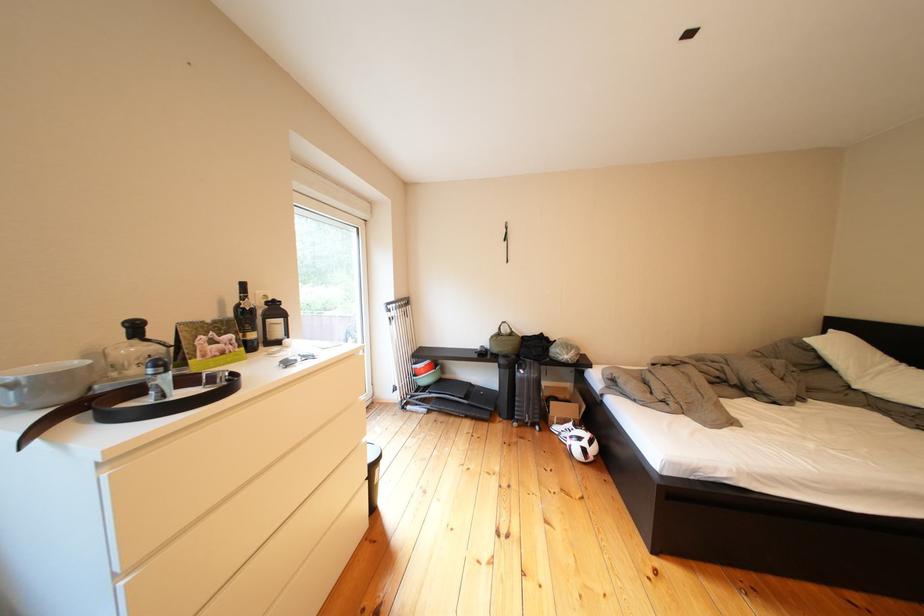
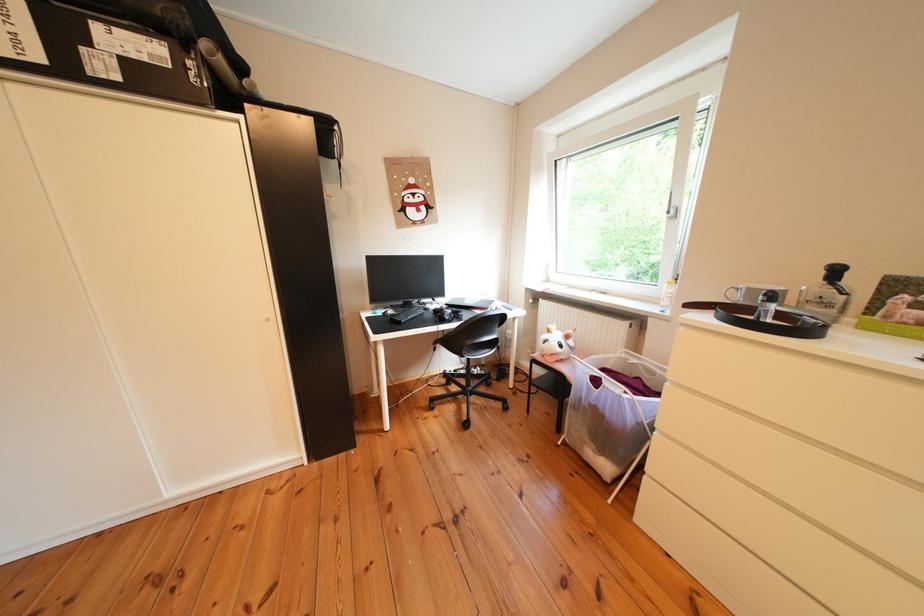
In the second image, find the point that corresponds to the point at 217,361 in the first image.

(901, 322)